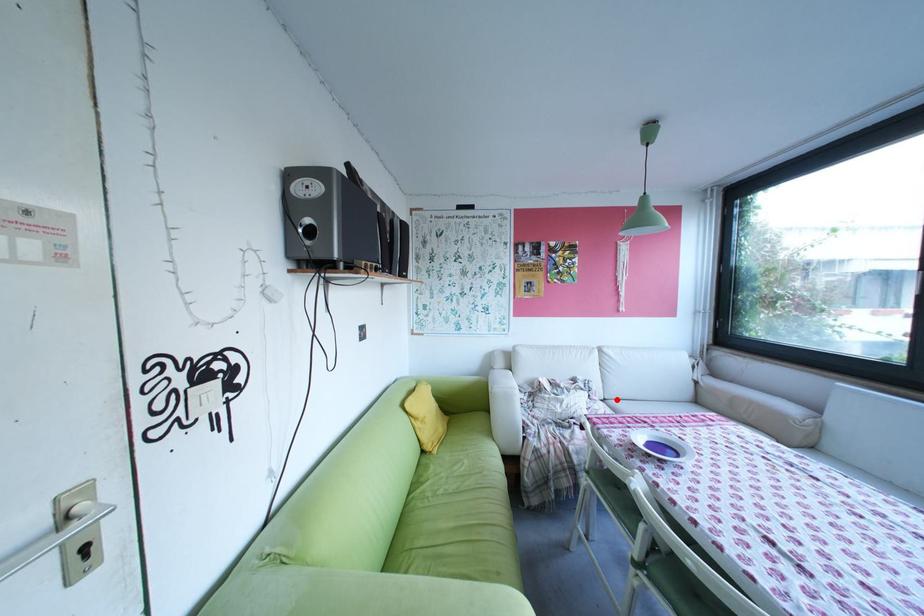
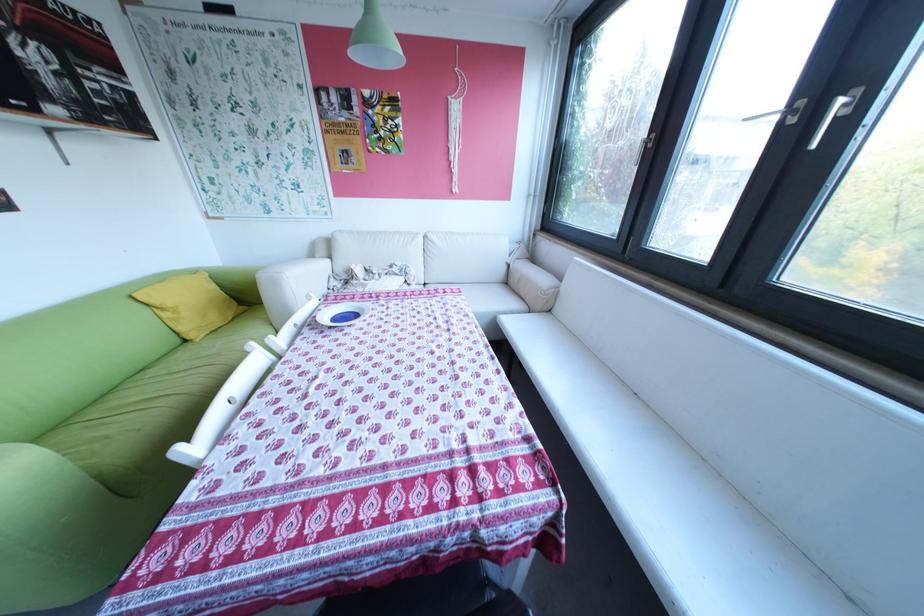
Question: I am providing you with two images of the same scene from different viewpoints. Given a red point in image1, look at the same physical point in image2. Is it:

Choices:
 (A) Closer to the viewpoint
 (B) Farther from the viewpoint

Answer: (B)